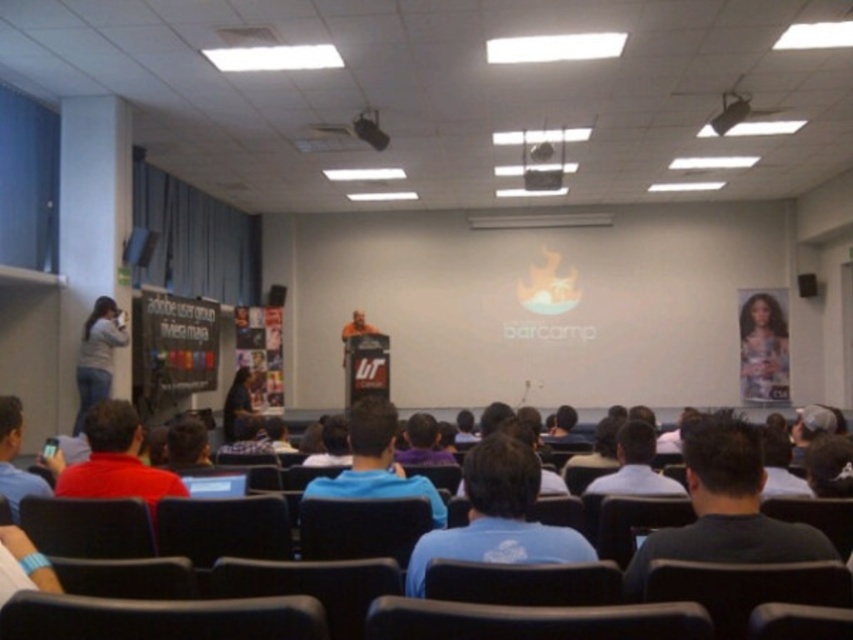
You are attending a BarCamp conference and notice two shirts at the center of the room. The blue cotton shirt at center and the checkered shirt at center. From your perspective sitting in the audience, which shirt is positioned higher?

The blue cotton shirt at center is located above the checkered shirt at center, so it is positioned higher from your perspective.

You are standing at the podium and looking at the audience. There is a point marked at coordinates point (97, 355). What object is this point located on?

The point (97, 355) is located on the gray cotton shirt at left.

You are an attendee sitting at point (103, 296) and want to exit the room through the door located at point (631, 445). Can you directly walk to the door without needing to go around any obstacles?

Point (103, 296) is behind point (631, 445), so you cannot directly walk to the door without needing to go around any obstacles.